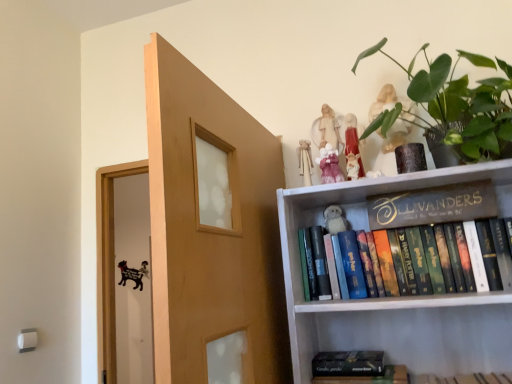
Question: Can we say white plush toy at upper center, acting as the 4th toy starting from the front, lies outside pink fabric doll at upper center, the second toy when ordered from front to back?

Choices:
 (A) yes
 (B) no

Answer: (A)

Question: Would you say white plush toy at upper center, acting as the 4th toy starting from the front, is a long distance from pink fabric doll at upper center, which appears as the third toy when viewed from the back?

Choices:
 (A) yes
 (B) no

Answer: (B)

Question: Is pink fabric doll at upper center, the second toy when ordered from front to back, completely or partially inside white plush toy at upper center, acting as the 4th toy starting from the front?

Choices:
 (A) yes
 (B) no

Answer: (B)

Question: From the image's perspective, is white plush toy at upper center, arranged as the 1th toy when viewed from the back, over pink fabric doll at upper center, which appears as the third toy when viewed from the back?

Choices:
 (A) yes
 (B) no

Answer: (B)

Question: Does white plush toy at upper center, acting as the 4th toy starting from the front, come in front of pink fabric doll at upper center, which appears as the third toy when viewed from the back?

Choices:
 (A) yes
 (B) no

Answer: (B)

Question: From a real-world perspective, relative to light brown wood door at center, is matte pink figurine at upper center, the fourth toy in the back-to-front sequence, vertically above or below?

Choices:
 (A) below
 (B) above

Answer: (B)

Question: In the image, is matte pink figurine at upper center, the fourth toy in the back-to-front sequence, on the left side or the right side of light brown wood door at center?

Choices:
 (A) right
 (B) left

Answer: (A)

Question: Does point (349, 158) appear closer or farther from the camera than point (266, 367)?

Choices:
 (A) closer
 (B) farther

Answer: (B)

Question: From the image's perspective, relative to light brown wood door at center, is matte pink figurine at upper center, which ranks as the 1th toy in front-to-back order, above or below?

Choices:
 (A) below
 (B) above

Answer: (B)

Question: In terms of size, does pink fabric doll at upper center, which appears as the third toy when viewed from the back, appear bigger or smaller than light brown wood door at center?

Choices:
 (A) big
 (B) small

Answer: (B)

Question: From a real-world perspective, relative to light brown wood door at center, is pink fabric doll at upper center, which appears as the third toy when viewed from the back, vertically above or below?

Choices:
 (A) below
 (B) above

Answer: (B)

Question: In terms of height, does pink fabric doll at upper center, which appears as the third toy when viewed from the back, look taller or shorter compared to light brown wood door at center?

Choices:
 (A) tall
 (B) short

Answer: (B)

Question: Looking at their shapes, would you say pink fabric doll at upper center, which appears as the third toy when viewed from the back, is wider or thinner than light brown wood door at center?

Choices:
 (A) thin
 (B) wide

Answer: (A)

Question: Looking at the image, does hardcover books at upper right, positioned as the 2th book in top-to-bottom order, seem bigger or smaller compared to hardcover book at lower center, the 1th book when ordered from bottom to top?

Choices:
 (A) small
 (B) big

Answer: (B)

Question: From the image's perspective, is hardcover books at upper right, positioned as the 2th book in top-to-bottom order, above or below hardcover book at lower center, the 1th book when ordered from bottom to top?

Choices:
 (A) above
 (B) below

Answer: (A)